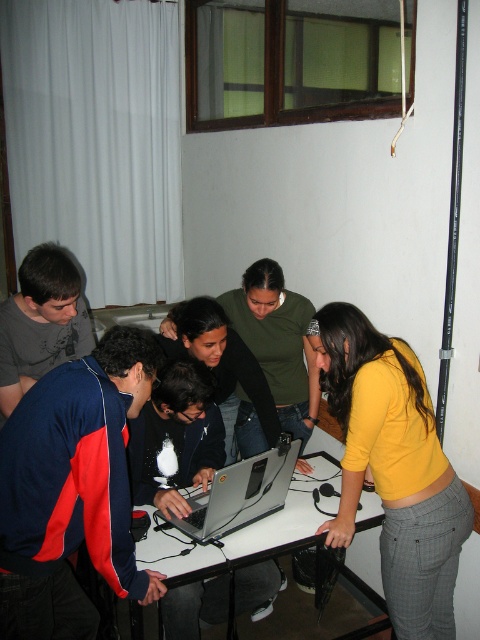
You are a guest entering the room and want to place a small gift on the table without blocking the laptop. Based on the scene description, can you determine if there is enough space on the white glossy table at center to place the gift next to the silver metallic laptop at center?

The white glossy table at center is positioned under the silver metallic laptop at center, which suggests the laptop is placed on the table. Since the table is at the center and the laptop is on it, there should be space next to the laptop on the table to place the gift without blocking it.

You are a photographer standing behind the group. You want to take a photo of the white glossy table at center without the yellow matte shirt at center blocking it. Is this possible?

The yellow matte shirt at center is in front of the white glossy table at center, so it is blocking the table. To take a photo of the white glossy table at center without the yellow matte shirt at center blocking it, you would need to move the yellow matte shirt at center or adjust your angle to ensure it is not in front of the table.